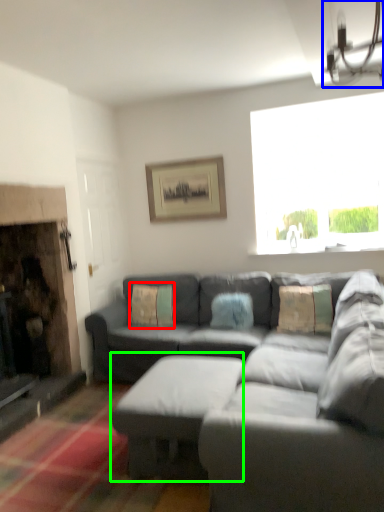
Question: Which object is positioned closest to pillow (highlighted by a red box)? Select from light fixture (highlighted by a blue box) and table (highlighted by a green box).

Choices:
 (A) light fixture
 (B) table

Answer: (B)